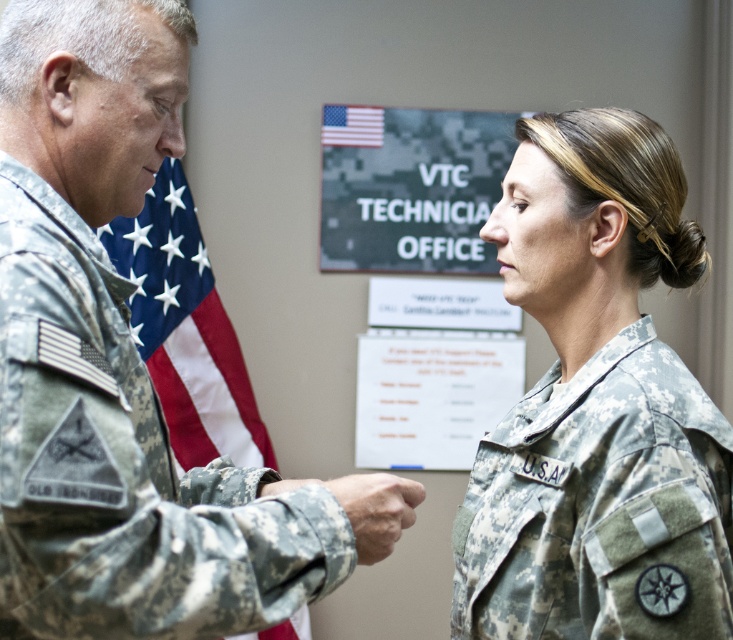
You are a military trainee who needs to retrieve the camouflage fabric flag at center from the camouflage uniform at left. Can you walk directly between them without needing to detour around any obstacles?

The distance between the camouflage uniform at left and the camouflage fabric flag at center is 1.67 meters, so yes, you can walk directly between them without needing to detour around any obstacles since there is sufficient space.

You are a military officer in the room. You need to determine which object at the center is more suitable for covering a small sensitive document. Which one between the camouflage fabric signboard at center and the camouflage fabric flag at center should you choose?

The camouflage fabric signboard at center is smaller than the camouflage fabric flag at center, so you should choose the camouflage fabric signboard at center to cover the small sensitive document.

Based on the scene description, where is the camouflage uniform at left located in the image?

The camouflage uniform at left is located at point (114, 360) in the image.